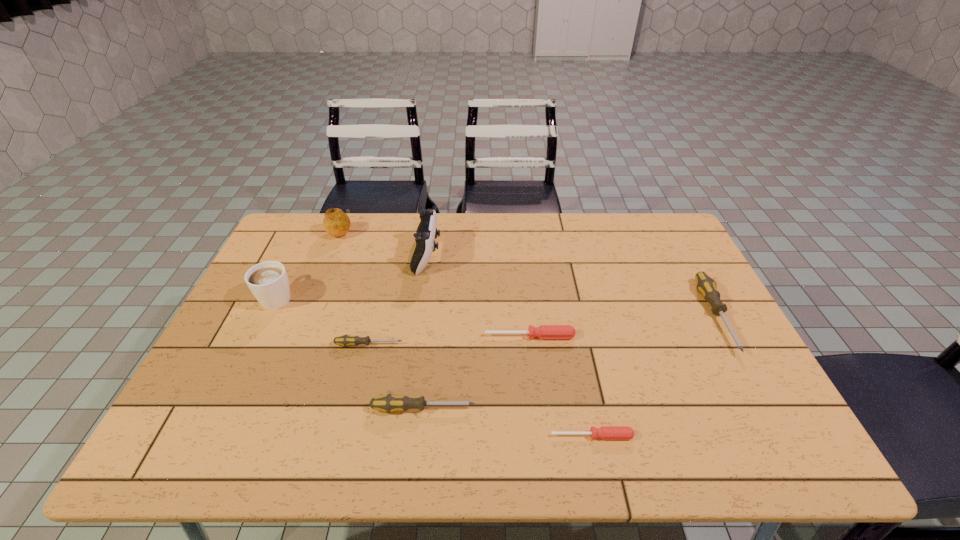
I want to click on control, so click(x=426, y=232).

The width and height of the screenshot is (960, 540). Find the location of `pear`. pear is located at coordinates (336, 223).

Locate an element on the screen. Image resolution: width=960 pixels, height=540 pixels. white cappuccino is located at coordinates (268, 281).

In order to click on cappuccino in this screenshot , I will do `click(268, 281)`.

Find the location of a particular element. Image resolution: width=960 pixels, height=540 pixels. the rightmost screwdriver is located at coordinates (705, 285).

I want to click on the fifth shortest object, so click(705, 285).

This screenshot has height=540, width=960. Find the location of `the second smallest gray screwdriver`. the second smallest gray screwdriver is located at coordinates (388, 403).

I want to click on the second nearest object, so click(388, 403).

This screenshot has width=960, height=540. What are the coordinates of `the farther red screwdriver` in the screenshot? It's located at (543, 331).

The image size is (960, 540). I want to click on the smallest gray screwdriver, so click(x=346, y=340).